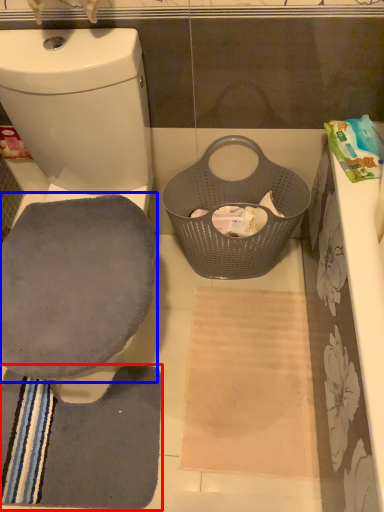
Question: Which object is closer to the camera taking this photo, bath towel (highlighted by a red box) or swivel chair (highlighted by a blue box)?

Choices:
 (A) bath towel
 (B) swivel chair

Answer: (B)